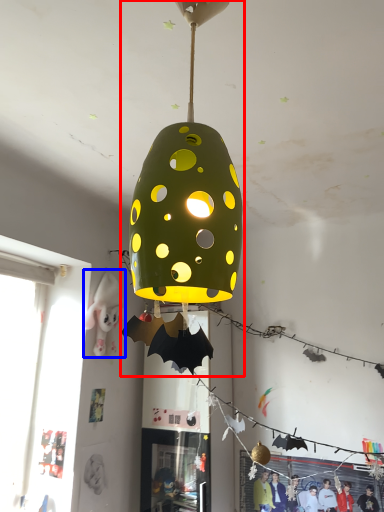
Question: Among these objects, which one is nearest to the camera, lamp (highlighted by a red box) or person (highlighted by a blue box)?

Choices:
 (A) lamp
 (B) person

Answer: (A)